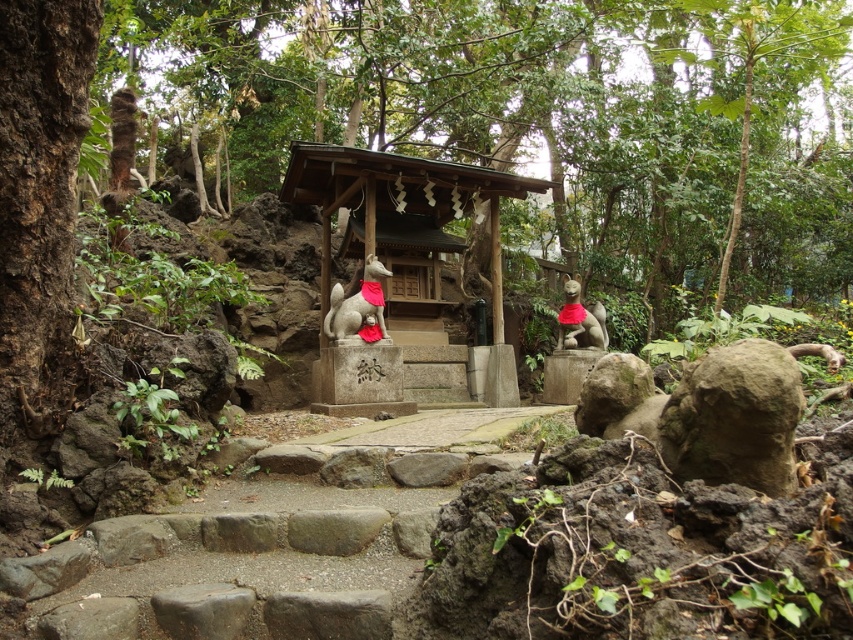
Which is behind, point (323, 323) or point (570, 346)?

Point (570, 346)

Is the position of matte gray fox at center less distant than that of matte stone fox at center?

Yes, matte gray fox at center is in front of matte stone fox at center.

This screenshot has height=640, width=853. What are the coordinates of `matte gray fox at center` in the screenshot? It's located at click(358, 307).

Based on the photo, who is positioned more to the right, smooth stone gazebo at center or matte gray fox at center?

From the viewer's perspective, smooth stone gazebo at center appears more on the right side.

At what (x,y) coordinates should I click in order to perform the action: click on smooth stone gazebo at center. Please return your answer as a coordinate pair (x, y). The image size is (853, 640). Looking at the image, I should click on (399, 204).

Does smooth stone gazebo at center appear on the right side of matte stone fox at center?

Incorrect, smooth stone gazebo at center is not on the right side of matte stone fox at center.

Between smooth stone gazebo at center and matte stone fox at center, which one is positioned higher?

smooth stone gazebo at center is higher up.

Is point (366, 221) positioned before point (563, 284)?

Yes.

Identify the location of smooth stone gazebo at center. The image size is (853, 640). (399, 204).